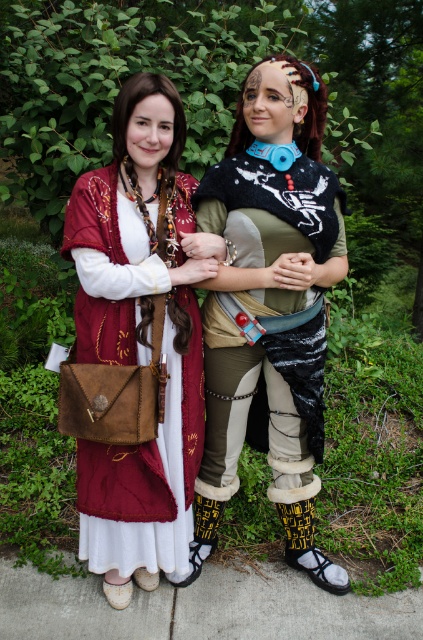
Is matte brown leather purse at center below suede brown purse at center?

No.

Is matte brown leather purse at center further to camera compared to suede brown purse at center?

That is False.

Is point (173, 316) positioned behind point (197, 404)?

No, (173, 316) is in front of (197, 404).

Identify the location of matte brown leather purse at center. (206, 320).